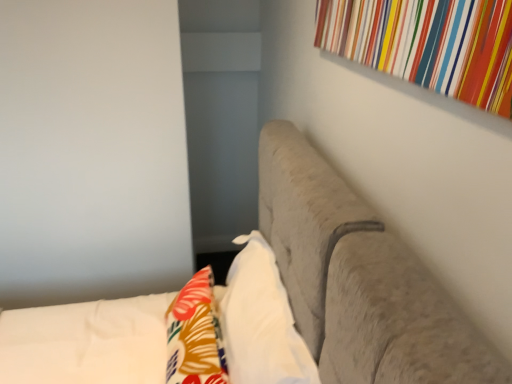
Question: Should I look upward or downward to see suede-like beige headboard at upper right?

Choices:
 (A) down
 (B) up

Answer: (A)

Question: Is suede-like beige headboard at upper right touching floral fabric throw pillow at lower left?

Choices:
 (A) yes
 (B) no

Answer: (B)

Question: Considering the relative sizes of suede-like beige headboard at upper right and floral fabric throw pillow at lower left in the image provided, is suede-like beige headboard at upper right shorter than floral fabric throw pillow at lower left?

Choices:
 (A) yes
 (B) no

Answer: (B)

Question: Does suede-like beige headboard at upper right lie in front of floral fabric throw pillow at lower left?

Choices:
 (A) yes
 (B) no

Answer: (A)

Question: Does suede-like beige headboard at upper right have a greater width compared to floral fabric throw pillow at lower left?

Choices:
 (A) yes
 (B) no

Answer: (A)

Question: Considering the relative sizes of suede-like beige headboard at upper right and floral fabric throw pillow at lower left in the image provided, is suede-like beige headboard at upper right bigger than floral fabric throw pillow at lower left?

Choices:
 (A) no
 (B) yes

Answer: (B)

Question: From the image's perspective, is suede-like beige headboard at upper right under floral fabric throw pillow at lower left?

Choices:
 (A) yes
 (B) no

Answer: (A)

Question: Is white soft pillow at center not close to suede-like beige headboard at upper right?

Choices:
 (A) yes
 (B) no

Answer: (B)

Question: Is white soft pillow at center in contact with suede-like beige headboard at upper right?

Choices:
 (A) yes
 (B) no

Answer: (B)

Question: Is suede-like beige headboard at upper right completely or partially inside white soft pillow at center?

Choices:
 (A) yes
 (B) no

Answer: (B)

Question: Is white soft pillow at center positioned before suede-like beige headboard at upper right?

Choices:
 (A) no
 (B) yes

Answer: (A)

Question: Is white soft pillow at center to the left of suede-like beige headboard at upper right from the viewer's perspective?

Choices:
 (A) no
 (B) yes

Answer: (A)

Question: From the image's perspective, is white soft pillow at center beneath suede-like beige headboard at upper right?

Choices:
 (A) no
 (B) yes

Answer: (A)

Question: Does white soft pillow at center have a greater height compared to floral fabric throw pillow at lower left?

Choices:
 (A) yes
 (B) no

Answer: (A)